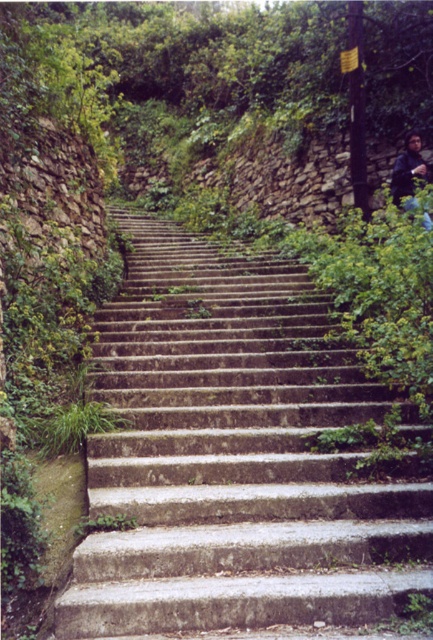
You are standing at the bottom of the stone steps leading up the hillside. You notice two points marked on the steps. One is at coordinate point (206, 369) and the other at point (412, 138). If you were to walk up the steps towards the hilltop, which point would you encounter first?

You would encounter point (206, 369) first because it is in front of point (412, 138) along the path upwards.

You are standing at the base of the gray concrete stairs at center and want to take a photo of them with your phone. Your phone can focus clearly on objects within 3 meters. Will the stairs be in focus?

The gray concrete stairs at center are 3.13 meters away from the camera, which is beyond the phone camera focus range of 3 meters. Therefore, the stairs will not be in focus.

You are standing at the bottom of the gray concrete stairs at center and want to reach the dark blue fabric jacket at upper right. Which direction should you move to get closer to the jacket?

You should move upwards along the gray concrete stairs at center since they are below the dark blue fabric jacket at upper right, meaning the jacket is located higher up the hillside.